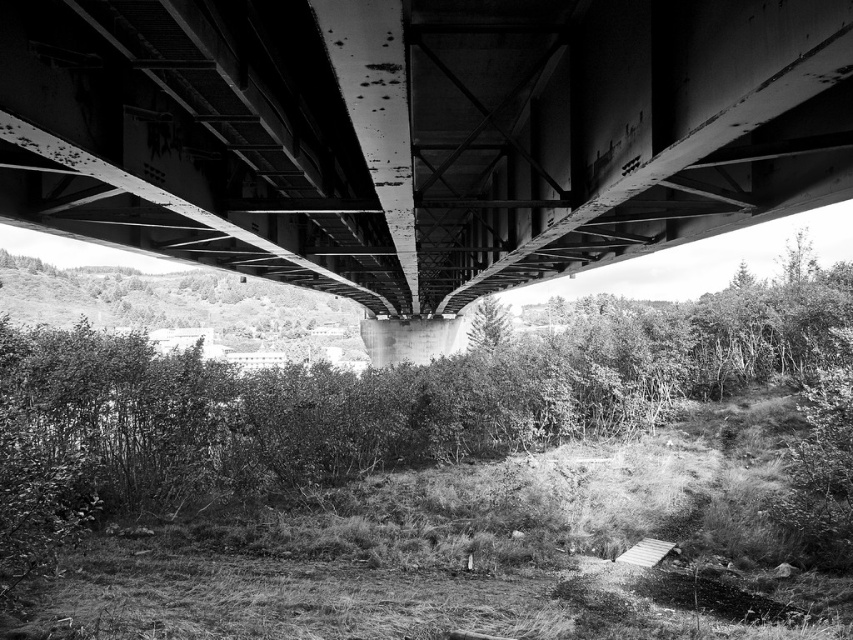
Question: Which point is closer to the camera?

Choices:
 (A) (850, 22)
 (B) (56, 618)

Answer: (A)

Question: Where is rusty metal bridge at center located in relation to green leafy shrubs at center in the image?

Choices:
 (A) below
 (B) above

Answer: (B)

Question: Can you confirm if rusty metal bridge at center is positioned to the right of green leafy shrubs at center?

Choices:
 (A) no
 (B) yes

Answer: (B)

Question: Among these objects, which one is nearest to the camera?

Choices:
 (A) rusty metal bridge at center
 (B) green leafy shrubs at center

Answer: (A)

Question: Can you confirm if rusty metal bridge at center is bigger than green leafy shrubs at center?

Choices:
 (A) yes
 (B) no

Answer: (B)

Question: Which of the following is the closest to the observer?

Choices:
 (A) (444, 518)
 (B) (296, 115)

Answer: (B)